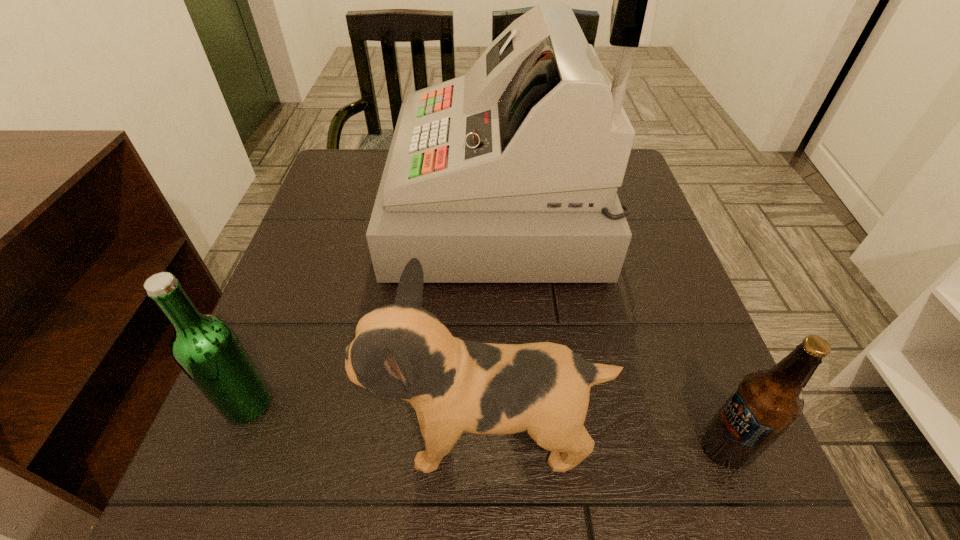
Find the location of a particular element. This screenshot has height=540, width=960. free spot between the puppy and the leftmost object is located at coordinates (367, 418).

I want to click on empty space that is in between the puppy and the right beer bottle, so (x=605, y=441).

Identify the location of free space between the puppy and the rightmost object. (605, 441).

Where is `free space between the cash register and the leftmost object`? This screenshot has width=960, height=540. free space between the cash register and the leftmost object is located at coordinates (373, 306).

Where is `free area in between the right beer bottle and the puppy`? The width and height of the screenshot is (960, 540). free area in between the right beer bottle and the puppy is located at coordinates (605, 441).

Find the location of a particular element. The width and height of the screenshot is (960, 540). object that stands as the closest to the leftmost object is located at coordinates (401, 350).

The width and height of the screenshot is (960, 540). What are the coordinates of `object that is the third closest to the rightmost object` in the screenshot? It's located at 206,348.

I want to click on free location that satisfies the following two spatial constraints: 1. on the keypad side of the farthest object; 2. on the front side of the leftmost object, so click(x=508, y=403).